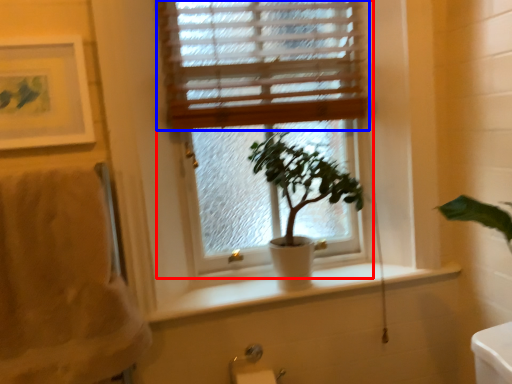
Question: Which point is further to the camera, window (highlighted by a red box) or window blind (highlighted by a blue box)?

Choices:
 (A) window
 (B) window blind

Answer: (B)